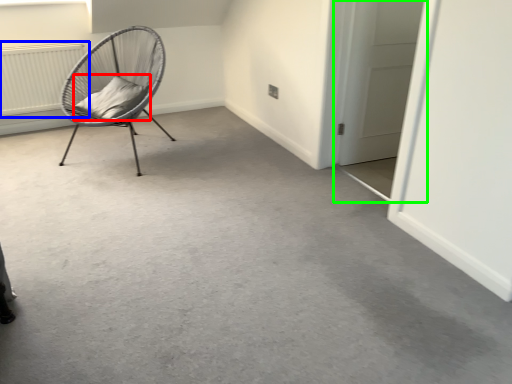
Question: Based on their relative distances, which object is nearer to pillow (highlighted by a red box)? Choose from radiator (highlighted by a blue box) and door (highlighted by a green box).

Choices:
 (A) radiator
 (B) door

Answer: (A)